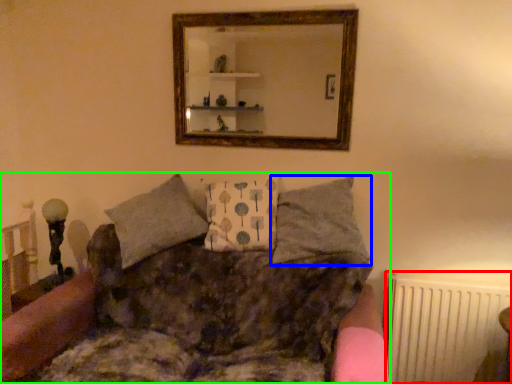
Question: Which is farther away from radiator (highlighted by a red box)? pillow (highlighted by a blue box) or studio couch (highlighted by a green box)?

Choices:
 (A) pillow
 (B) studio couch

Answer: (B)